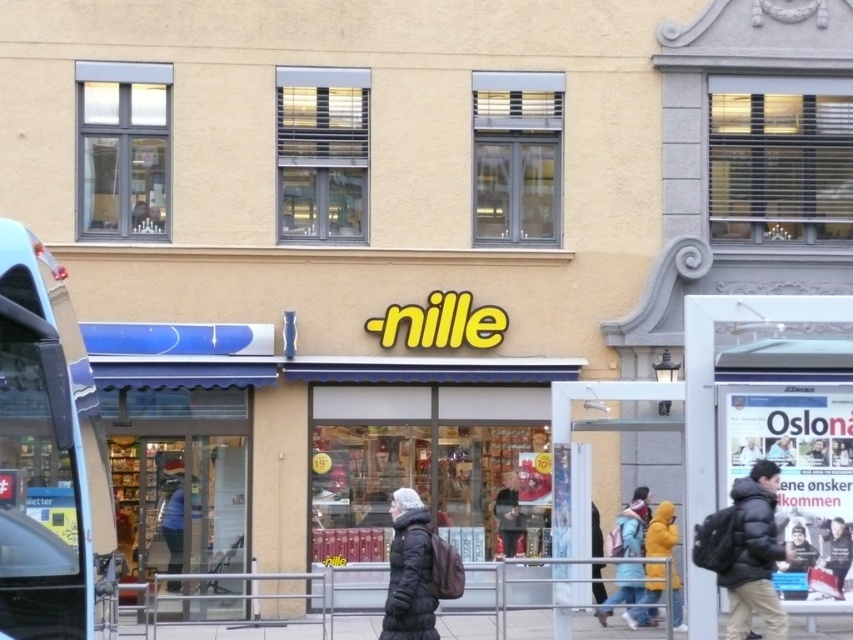
Question: Is black matte jacket at lower right to the right of light blue jacket at center from the viewer's perspective?

Choices:
 (A) yes
 (B) no

Answer: (A)

Question: Can you confirm if metallic silver bus at left is thinner than black matte jacket at lower right?

Choices:
 (A) yes
 (B) no

Answer: (A)

Question: Based on their relative distances, which object is farther from the dark gray jacket at center?

Choices:
 (A) metallic silver bus at left
 (B) black puffy jacket at center
 (C) gray concrete pavement at lower center

Answer: (A)

Question: Is white plastic bus stop at lower right bigger than light blue jacket at center?

Choices:
 (A) no
 (B) yes

Answer: (A)

Question: Considering the real-world distances, which object is closest to the dark gray jacket at center?

Choices:
 (A) light blue jacket at center
 (B) black puffy jacket at center

Answer: (A)

Question: Which point is closer to the camera?

Choices:
 (A) (735, 490)
 (B) (740, 298)
 (C) (505, 516)
 (D) (850, 545)

Answer: (A)